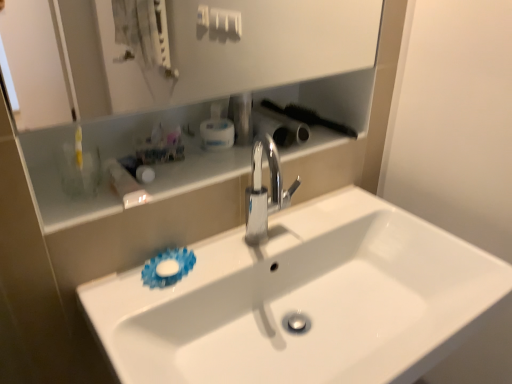
At what (x,y) coordinates should I click in order to perform the action: click on free space in front of metallic silver toothbrush at upper center, marked as the 1th toiletry in a top-to-bottom arrangement. Please return your answer as a coordinate pair (x, y). The image size is (512, 384). Looking at the image, I should click on (223, 163).